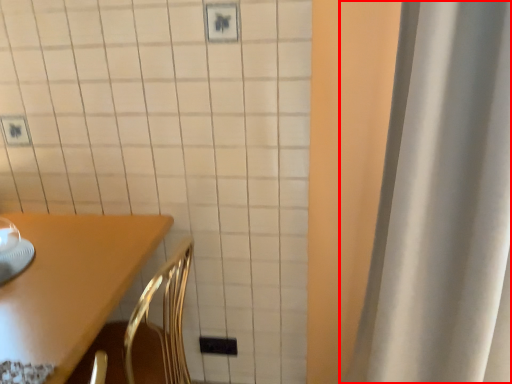
Question: From the image's perspective, where is curtain (annotated by the red box) located relative to furniture?

Choices:
 (A) above
 (B) below

Answer: (A)